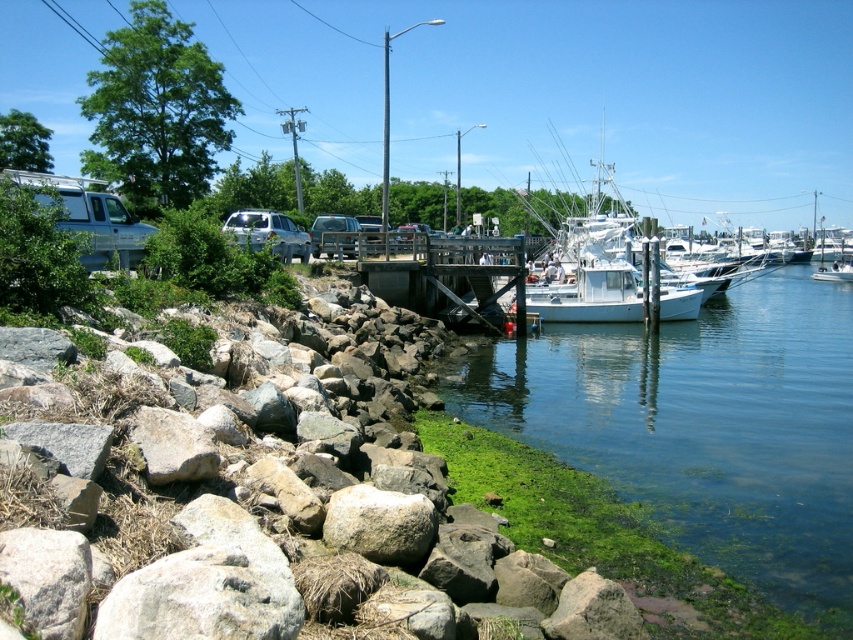
You are standing at the center of the wooden pier and want to reach the rocky shore at lower left. Based on the coordinates provided in the Objects Description, in which direction should you move to get there?

The rocky shore at lower left is located at point coordinates, so you should move towards the lower left direction to reach it.

You are standing at the rocky shoreline and want to walk to the red fire extinguisher on the pier. Which point, point (519, 278) or point (187, 445), is closer to your current position?

Point (519, 278) is closer to your current position because it is further to the viewer than point (187, 445), meaning it is nearer to the shoreline where you are standing.

You are a painter setting up your easel to capture the waterfront scene. You want to ensure your setup doesn not block the view of both the wooden dock at center and the gray rough rock at lower left. Given their sizes, which object might require more space between your easel and the scene to fully include in your painting?

The wooden dock at center has a larger size compared to the gray rough rock at lower left, so it would require more space between your easel and the scene to fully include in your painting.